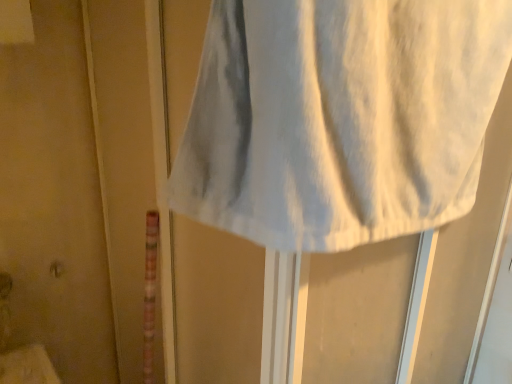
Find the location of a particular element. The image size is (512, 384). white fabric curtain at upper center is located at coordinates pos(340,118).

What is the approximate height of white fabric curtain at upper center?

white fabric curtain at upper center is 37.45 centimeters in height.

The image size is (512, 384). Describe the element at coordinates (340, 118) in the screenshot. I see `white fabric curtain at upper center` at that location.

This screenshot has width=512, height=384. I want to click on white fabric curtain at upper center, so click(340, 118).